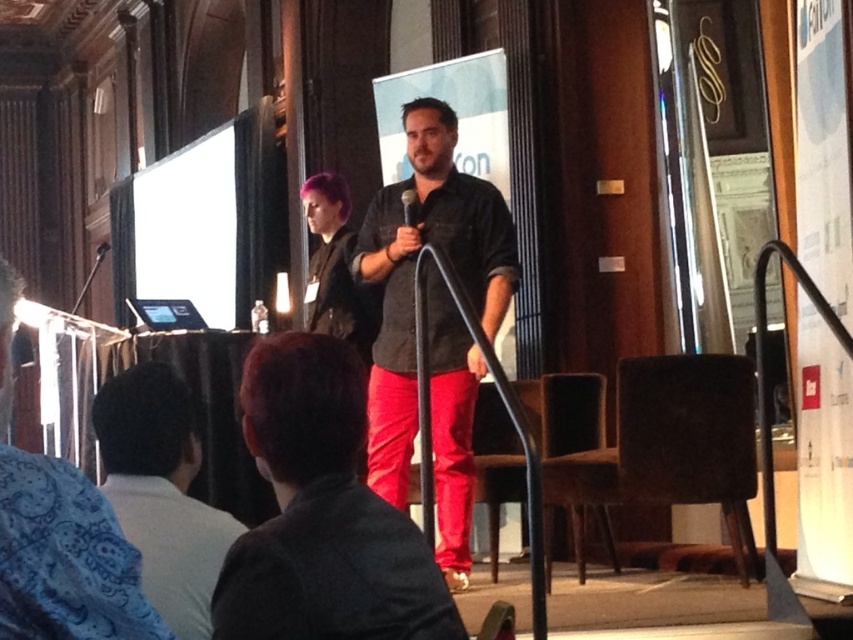
Question: Which point is farther from the camera taking this photo?

Choices:
 (A) (315, 577)
 (B) (413, 204)

Answer: (B)

Question: Among these objects, which one is farthest from the camera?

Choices:
 (A) smooth black shirt at center
 (B) black matte microphone at center
 (C) matte black shirt at center
 (D) light brown leather jacket at lower left

Answer: (B)

Question: Does matte black shirt at center have a greater width compared to black matte microphone at center?

Choices:
 (A) yes
 (B) no

Answer: (A)

Question: Does matte black shirt at center appear on the right side of light brown leather jacket at lower left?

Choices:
 (A) no
 (B) yes

Answer: (B)

Question: Which point is closer to the camera?

Choices:
 (A) matte black shirt at center
 (B) light brown leather jacket at lower left

Answer: (B)

Question: Can you confirm if light brown leather jacket at lower left is positioned above black matte microphone at center?

Choices:
 (A) no
 (B) yes

Answer: (A)